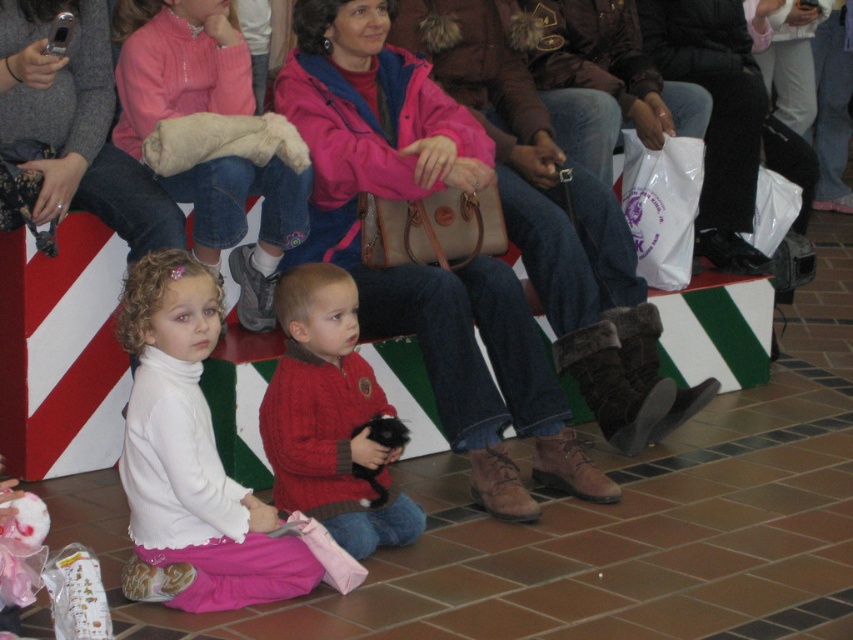
Who is more distant from viewer, (194, 84) or (636, 186)?

Point (636, 186)

Is white soft sweater at lower left smaller than white plastic bag at center?

No.

This screenshot has width=853, height=640. What do you see at coordinates (177, 65) in the screenshot?
I see `white soft sweater at lower left` at bounding box center [177, 65].

Find the location of a particular element. white soft sweater at lower left is located at coordinates (177, 65).

Is matte pink jacket at center bigger than white plastic bag at center?

Correct, matte pink jacket at center is larger in size than white plastic bag at center.

Who is more forward, [363,104] or [679,152]?

Positioned in front is point [363,104].

Find the location of a particular element. The height and width of the screenshot is (640, 853). matte pink jacket at center is located at coordinates [x=421, y=264].

Between matte pink jacket at center and white soft sweater at lower left, which one has more height?

Standing taller between the two is matte pink jacket at center.

Who is more forward, (440, 298) or (241, 38)?

Point (440, 298) is more forward.

Image resolution: width=853 pixels, height=640 pixels. I want to click on matte pink jacket at center, so click(421, 264).